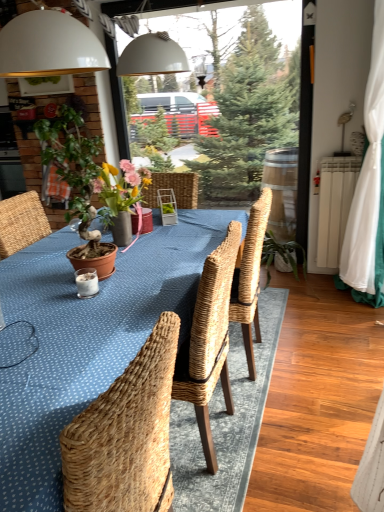
The width and height of the screenshot is (384, 512). What do you see at coordinates (86, 339) in the screenshot?
I see `blue woven table at center` at bounding box center [86, 339].

The width and height of the screenshot is (384, 512). What do you see at coordinates (368, 190) in the screenshot? I see `white fabric curtain at right` at bounding box center [368, 190].

This screenshot has height=512, width=384. I want to click on blue woven table at center, so click(86, 339).

Which object is positioned more to the left, terracotta pot at left or white fabric curtain at right?

From the viewer's perspective, terracotta pot at left appears more on the left side.

From the image's perspective, is terracotta pot at left positioned above or below white fabric curtain at right?

terracotta pot at left is situated lower than white fabric curtain at right in the image.

Who is more distant, terracotta pot at left or white fabric curtain at right?

Positioned behind is white fabric curtain at right.

From the image's perspective, is terracotta pot at left located beneath blue woven table at center?

No, from the image's perspective, terracotta pot at left is not beneath blue woven table at center.

From a real-world perspective, is terracotta pot at left beneath blue woven table at center?

No, from a real-world perspective, terracotta pot at left is not below blue woven table at center.

Find the location of a particular element. The image size is (384, 512). kitchen & dining room table in front of the terracotta pot at left is located at coordinates tap(86, 339).

Is the position of terracotta pot at left more distant than that of blue woven table at center?

Yes, the depth of terracotta pot at left is greater than that of blue woven table at center.

From the image's perspective, is blue woven table at center beneath terracotta pot at left?

Correct, blue woven table at center appears lower than terracotta pot at left in the image.

Considering the relative sizes of blue woven table at center and terracotta pot at left in the image provided, is blue woven table at center taller than terracotta pot at left?

Correct, blue woven table at center is much taller as terracotta pot at left.

Could you tell me if blue woven table at center is turned towards terracotta pot at left?

No, blue woven table at center is not aimed at terracotta pot at left.

Do you think blue woven table at center is within terracotta pot at left, or outside of it?

blue woven table at center is located beyond the bounds of terracotta pot at left.

Between white fabric curtain at right and blue woven table at center, which one has larger width?

Wider between the two is blue woven table at center.

Is white fabric curtain at right aimed at blue woven table at center?

No, white fabric curtain at right is not facing towards blue woven table at center.

What's the angular difference between white fabric curtain at right and blue woven table at center's facing directions?

They differ by 5.32 degrees in their facing directions.

How different are the orientations of white fabric curtain at right and terracotta pot at left in degrees?

There is a 2.63-degree angle between the facing directions of white fabric curtain at right and terracotta pot at left.

Where is `houseplant above the white fabric curtain at right (from a real-world perspective)`? houseplant above the white fabric curtain at right (from a real-world perspective) is located at coordinates pyautogui.click(x=77, y=182).

From the picture: Between white fabric curtain at right and terracotta pot at left, which one has smaller width?

white fabric curtain at right.

From a real-world perspective, between white fabric curtain at right and terracotta pot at left, who is vertically higher?

terracotta pot at left.

Looking at the image, does blue woven table at center seem bigger or smaller compared to white fabric curtain at right?

In the image, blue woven table at center appears to be larger than white fabric curtain at right.

Could you tell me if blue woven table at center is turned towards white fabric curtain at right?

No, blue woven table at center does not turn towards white fabric curtain at right.

Is blue woven table at center to the left of white fabric curtain at right from the viewer's perspective?

Yes, blue woven table at center is to the left of white fabric curtain at right.

Is blue woven table at center wider or thinner than white fabric curtain at right?

In the image, blue woven table at center appears to be wider than white fabric curtain at right.

At what (x,y) coordinates should I click in order to perform the action: click on houseplant that appears on the left of white fabric curtain at right. Please return your answer as a coordinate pair (x, y). The image size is (384, 512). Looking at the image, I should click on (77, 182).

Locate an element on the screen. This screenshot has height=512, width=384. houseplant above the blue woven table at center (from the image's perspective) is located at coordinates (77, 182).

When comparing their distances from terracotta pot at left, does blue woven table at center or white fabric curtain at right seem closer?

blue woven table at center.

From the picture: When comparing their distances from blue woven table at center, does white fabric curtain at right or terracotta pot at left seem closer?

Based on the image, terracotta pot at left appears to be nearer to blue woven table at center.

Considering their positions, is blue woven table at center positioned further to white fabric curtain at right than terracotta pot at left?

Among the two, terracotta pot at left is located further to white fabric curtain at right.

Estimate the real-world distances between objects in this image. Which object is closer to white fabric curtain at right, terracotta pot at left or blue woven table at center?

The object closer to white fabric curtain at right is blue woven table at center.

When comparing their distances from blue woven table at center, does terracotta pot at left or white fabric curtain at right seem closer?

terracotta pot at left.

From the image, which object appears to be nearer to terracotta pot at left, white fabric curtain at right or blue woven table at center?

Based on the image, blue woven table at center appears to be nearer to terracotta pot at left.

Find the location of `kitchen & dining room table between terracotta pot at left and white fabric curtain at right in the horizontal direction`. kitchen & dining room table between terracotta pot at left and white fabric curtain at right in the horizontal direction is located at coordinates (86, 339).